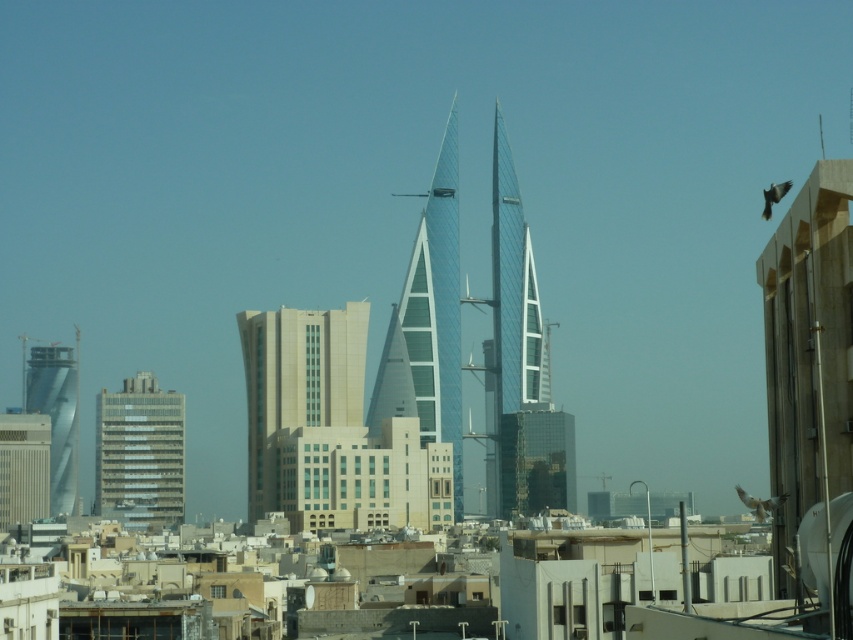
Is beige glass building at center taller than matte gray building at lower left?

Yes.

In the scene shown: Is beige glass building at center thinner than matte gray building at lower left?

In fact, beige glass building at center might be wider than matte gray building at lower left.

This screenshot has width=853, height=640. What are the coordinates of `beige glass building at center` in the screenshot? It's located at (299, 378).

Can you confirm if glassy blue skyscraper at center is smaller than glassy reflective building at lower left?

No.

Who is positioned more to the right, glassy blue skyscraper at center or glassy reflective building at lower left?

glassy blue skyscraper at center

At what (x,y) coordinates should I click in order to perform the action: click on glassy blue skyscraper at center. Please return your answer as a coordinate pair (x, y). The image size is (853, 640). Looking at the image, I should click on (428, 323).

You are a GUI agent. You are given a task and a screenshot of the screen. Output one action in this format:
    pyautogui.click(x=<x>, y=<y>)
    Task: Click on the glassy blue skyscraper at center
    
    Given the screenshot: What is the action you would take?
    pyautogui.click(x=428, y=323)

Is glassy blue skyscraper at center taller than beige glass building at center?

Yes.

Which is above, glassy blue skyscraper at center or beige glass building at center?

glassy blue skyscraper at center is higher up.

Which is behind, point (403, 330) or point (256, 444)?

Point (256, 444)

You are a GUI agent. You are given a task and a screenshot of the screen. Output one action in this format:
    pyautogui.click(x=<x>, y=<y>)
    Task: Click on the glassy blue skyscraper at center
    
    Given the screenshot: What is the action you would take?
    pyautogui.click(x=428, y=323)